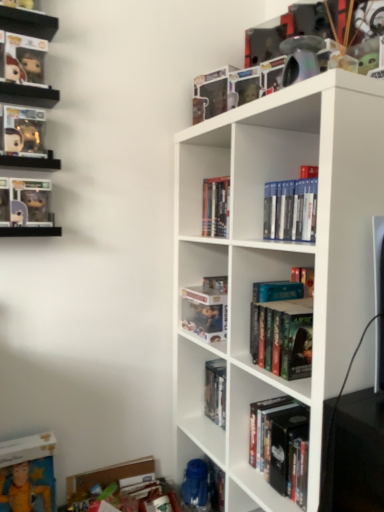
Question: Is the depth of metallic rainbow pipe at upper right greater than that of clear plastic figurines at upper left, which is counted as the 1th shelf, starting from the back?

Choices:
 (A) yes
 (B) no

Answer: (B)

Question: Would you say metallic rainbow pipe at upper right is outside clear plastic figurines at upper left, arranged as the 1th shelf when viewed from the top?

Choices:
 (A) yes
 (B) no

Answer: (A)

Question: Is metallic rainbow pipe at upper right facing towards clear plastic figurines at upper left, arranged as the 1th shelf when viewed from the top?

Choices:
 (A) yes
 (B) no

Answer: (B)

Question: Can you confirm if metallic rainbow pipe at upper right is thinner than clear plastic figurines at upper left, acting as the 1th shelf starting from the left?

Choices:
 (A) yes
 (B) no

Answer: (A)

Question: Does metallic rainbow pipe at upper right come in front of clear plastic figurines at upper left, acting as the 1th shelf starting from the left?

Choices:
 (A) yes
 (B) no

Answer: (A)

Question: In the image, is blue plastic water bottle at lower center on the left side or the right side of matte black figurine at upper left, the second book viewed from the left?

Choices:
 (A) left
 (B) right

Answer: (B)

Question: Looking at their shapes, would you say blue plastic water bottle at lower center is wider or thinner than matte black figurine at upper left, placed as the seventh book when sorted from right to left?

Choices:
 (A) wide
 (B) thin

Answer: (A)

Question: Is blue plastic water bottle at lower center spatially inside matte black figurine at upper left, placed as the seventh book when sorted from right to left, or outside of it?

Choices:
 (A) inside
 (B) outside

Answer: (B)

Question: From the image's perspective, relative to matte black figurine at upper left, placed as the seventh book when sorted from right to left, is blue plastic water bottle at lower center above or below?

Choices:
 (A) below
 (B) above

Answer: (A)

Question: Based on their sizes in the image, would you say clear plastic figurines at upper left, acting as the second shelf starting from the front, is bigger or smaller than hardcover books at center, the 4th book positioned from the left?

Choices:
 (A) small
 (B) big

Answer: (A)

Question: From the image's perspective, is clear plastic figurines at upper left, arranged as the 1th shelf when viewed from the top, located above or below hardcover books at center, the fifth book viewed from the right?

Choices:
 (A) above
 (B) below

Answer: (A)

Question: Is clear plastic figurines at upper left, arranged as the 1th shelf when viewed from the top, taller or shorter than hardcover books at center, the 4th book positioned from the left?

Choices:
 (A) tall
 (B) short

Answer: (B)

Question: Does point (1, 25) appear closer or farther from the camera than point (210, 208)?

Choices:
 (A) farther
 (B) closer

Answer: (B)

Question: Is clear plastic figurines at upper left, acting as the second shelf starting from the front, inside or outside of hardcover book at center, the fifth book from the left?

Choices:
 (A) outside
 (B) inside

Answer: (A)

Question: Visually, is clear plastic figurines at upper left, acting as the 1th shelf starting from the left, positioned to the left or to the right of hardcover book at center, the fifth book from the left?

Choices:
 (A) right
 (B) left

Answer: (B)